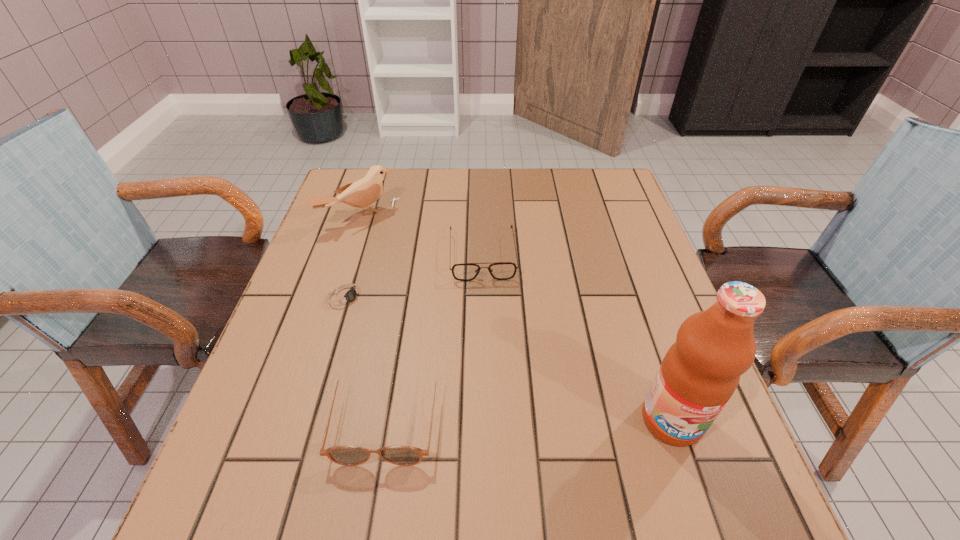
Where is `the left sunglasses`? This screenshot has width=960, height=540. the left sunglasses is located at coordinates (344, 455).

Locate an element on the screen. fruit juice is located at coordinates (700, 372).

Locate an element on the screen. The height and width of the screenshot is (540, 960). the tallest object is located at coordinates (700, 372).

The height and width of the screenshot is (540, 960). In order to click on the shortest object in this screenshot , I will do `click(344, 296)`.

At what (x,y) coordinates should I click in order to perform the action: click on bird. Please return your answer as a coordinate pair (x, y). The image size is (960, 540). Looking at the image, I should click on (363, 193).

The image size is (960, 540). What are the coordinates of `the fourth object from left to right` in the screenshot? It's located at (499, 270).

The image size is (960, 540). What are the coordinates of `the right sunglasses` in the screenshot? It's located at (499, 270).

Locate an element on the screen. Image resolution: width=960 pixels, height=540 pixels. vacant area situated on the face of the shortest object is located at coordinates (470, 374).

The height and width of the screenshot is (540, 960). In order to click on vacant space located 0.100m on the face of the shortest object in this screenshot , I will do `click(397, 328)`.

The image size is (960, 540). I want to click on free space located on the face of the shortest object, so click(x=401, y=330).